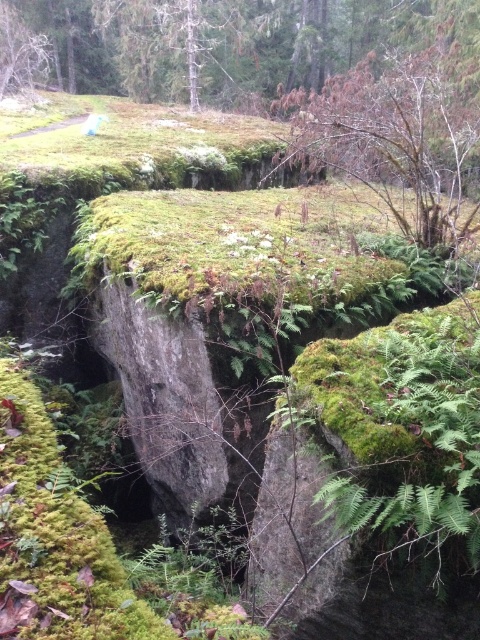
Question: Which of the following is the closest to the observer?

Choices:
 (A) brown wood tree at upper left
 (B) brown/dry wood at upper center

Answer: (B)

Question: Does brown/dry wood at upper center have a greater width compared to brown wood tree at upper left?

Choices:
 (A) no
 (B) yes

Answer: (A)

Question: Which point is closer to the camera taking this photo?

Choices:
 (A) (328, 97)
 (B) (7, 38)

Answer: (A)

Question: Can you confirm if brown/dry wood at upper center is thinner than brown wood tree at upper left?

Choices:
 (A) yes
 (B) no

Answer: (A)

Question: Does brown/dry wood at upper center appear under brown wood tree at upper left?

Choices:
 (A) no
 (B) yes

Answer: (B)

Question: Which of the following is the closest to the observer?

Choices:
 (A) (332, 141)
 (B) (3, 35)

Answer: (A)